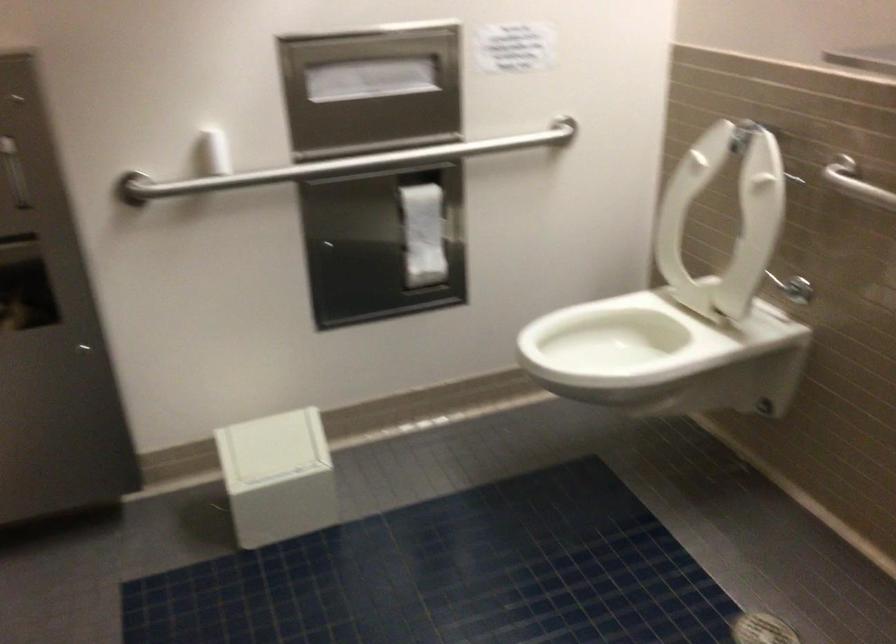
This screenshot has height=644, width=896. Describe the element at coordinates (793, 288) in the screenshot. I see `the toilet flush lever` at that location.